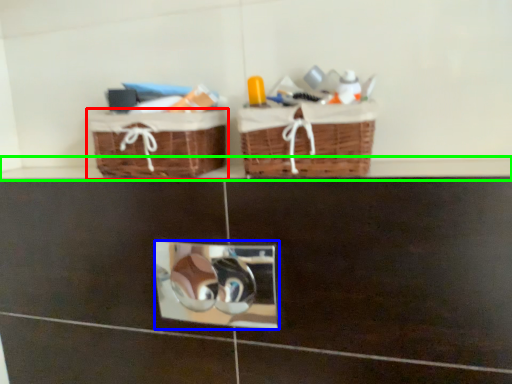
Question: Which is farther away from picnic basket (highlighted by a red box)? mirror (highlighted by a blue box) or ledge (highlighted by a green box)?

Choices:
 (A) mirror
 (B) ledge

Answer: (A)